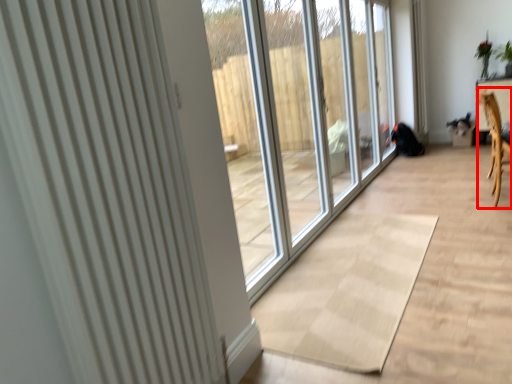
Question: From the image's perspective, what is the correct spatial positioning of armchair (annotated by the red box) in reference to radiator?

Choices:
 (A) below
 (B) above

Answer: (B)